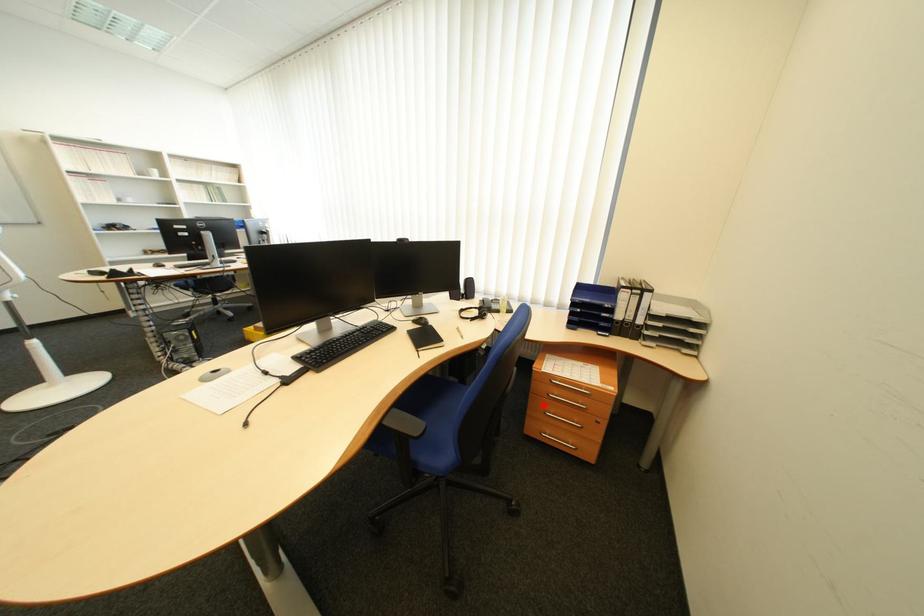
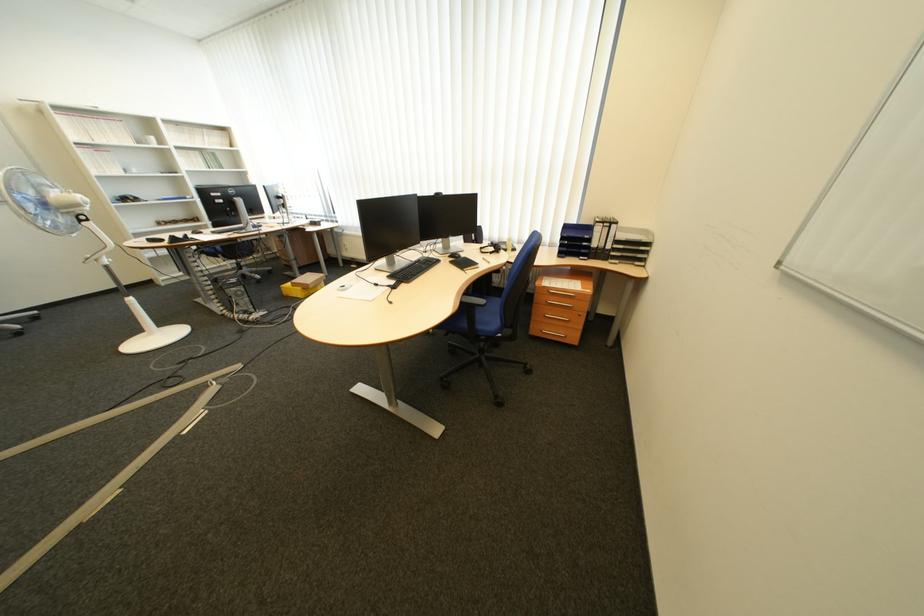
Question: A red point is marked in image1. In image2, is the corresponding 3D point closer to the camera or farther? Reply with the corresponding letter.

Choices:
 (A) The corresponding 3D point is closer.
 (B) The corresponding 3D point is farther.

Answer: (A)